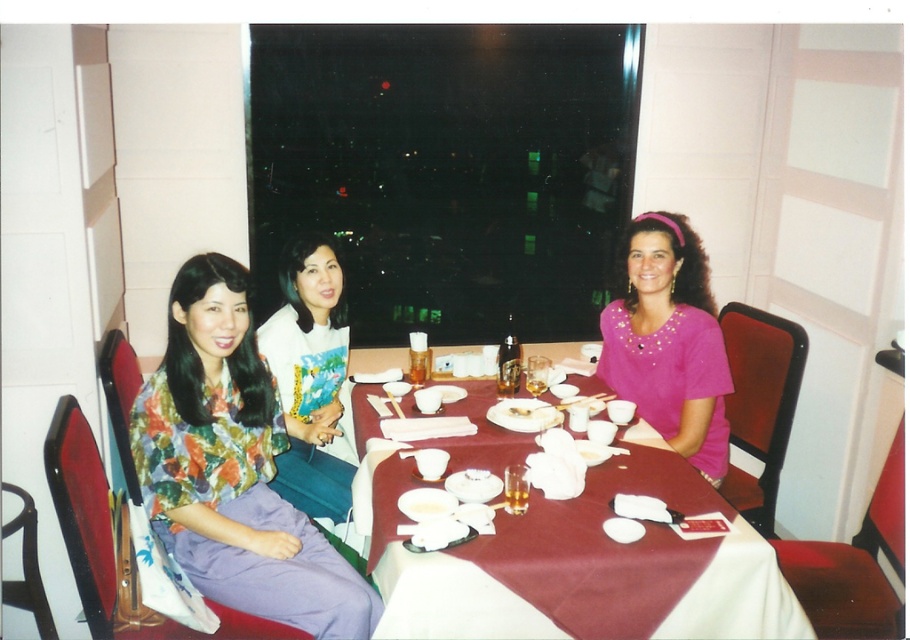
Question: In this image, where is maroon fabric table at center located relative to floral fabric blouse at center?

Choices:
 (A) left
 (B) right

Answer: (B)

Question: Which point is farther from the camera taking this photo?

Choices:
 (A) (329, 403)
 (B) (641, 448)
 (C) (177, 420)
 (D) (685, 385)

Answer: (A)

Question: Among these points, which one is nearest to the camera?

Choices:
 (A) (630, 321)
 (B) (221, 435)

Answer: (B)

Question: Based on their relative distances, which object is farther from the white fabric shirt at center?

Choices:
 (A) maroon fabric table at center
 (B) floral fabric blouse at center

Answer: (A)

Question: Is maroon fabric table at center positioned at the back of white fabric shirt at center?

Choices:
 (A) no
 (B) yes

Answer: (A)

Question: Is the position of floral fabric blouse at center less distant than that of pink satin blouse at center?

Choices:
 (A) no
 (B) yes

Answer: (B)